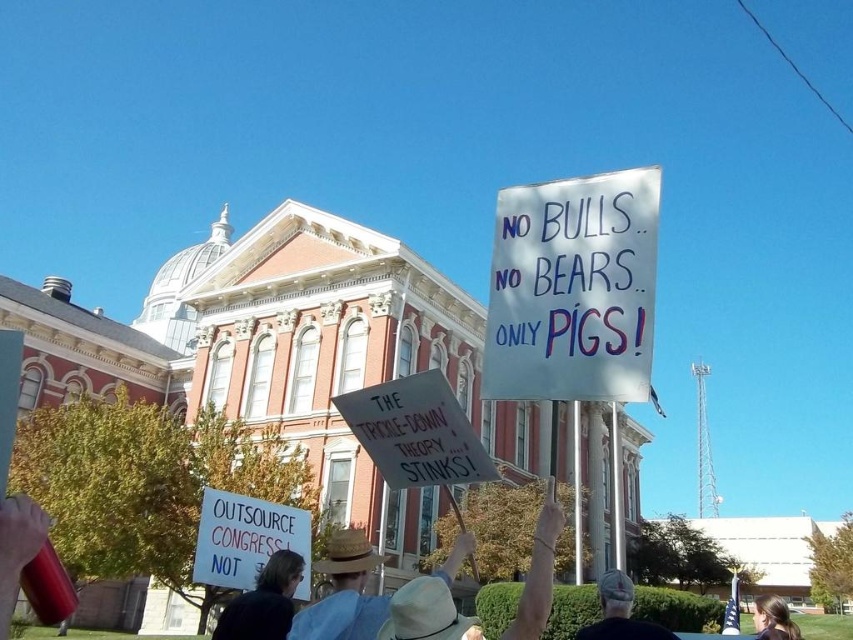
You are a photographer trying to capture a clear shot of the white paper sign at center and the denim cap at center. Which object should you focus on first to ensure both are in focus?

The white paper sign at center is closer to the viewer than the denim cap at center. To ensure both are in focus, focus on the white paper sign at center first, as it is closer, and adjust the depth of field accordingly.

You are a photographer trying to capture a closeup of the dark brown leather jacket at lower center and the denim cap at center. Which object should you zoom in on to ensure both are in focus without moving the camera?

The dark brown leather jacket at lower center has a smaller size compared to denim cap at center, so you should zoom in on the smaller dark brown leather jacket at lower center to ensure both are in focus without moving the camera.

You are a photographer trying to capture a clear shot of the protest signs. You notice the straw hat at center and the dark brown leather jacket at lower center are blocking your view. Which object is closer to the camera, making it the primary obstruction?

The dark brown leather jacket at lower center is closer to the camera than the straw hat at center, so it is the primary obstruction.